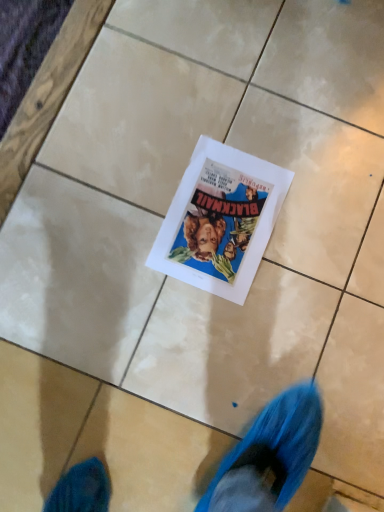
Where is `vacant space positioned to the left of matte paper poster at center`? This screenshot has width=384, height=512. vacant space positioned to the left of matte paper poster at center is located at coordinates (116, 188).